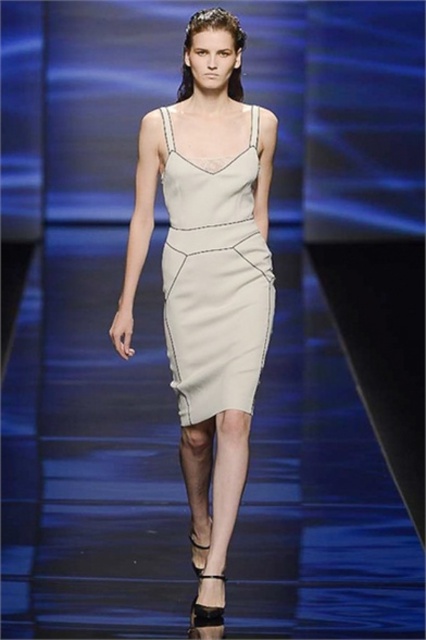
Who is positioned more to the left, satin dress at center or satin beige dress at center?

satin dress at center is more to the left.

Can you confirm if satin dress at center is thinner than satin beige dress at center?

Incorrect, satin dress at center's width is not less than satin beige dress at center's.

Identify the location of satin dress at center. (207, 276).

Identify the location of satin dress at center. (207, 276).